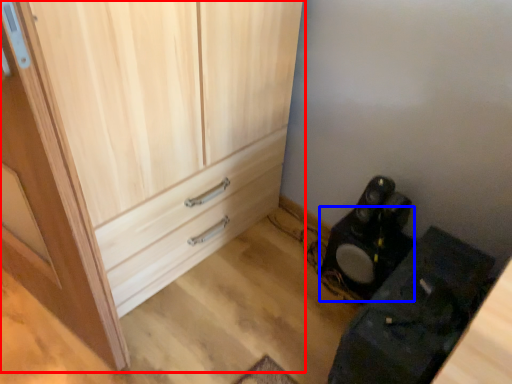
Question: Which object is closer to the camera taking this photo, cupboard (highlighted by a red box) or speaker (highlighted by a blue box)?

Choices:
 (A) cupboard
 (B) speaker

Answer: (A)